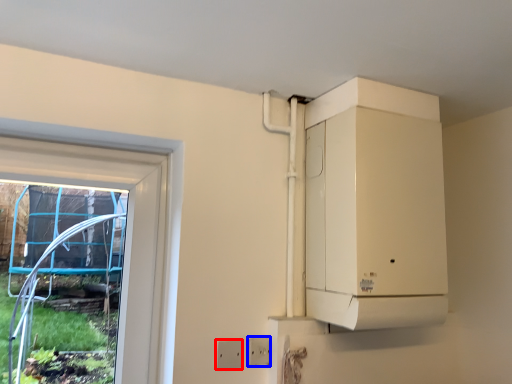
Question: Which point is closer to the camera, electric outlet (highlighted by a red box) or electric outlet (highlighted by a blue box)?

Choices:
 (A) electric outlet
 (B) electric outlet

Answer: (A)